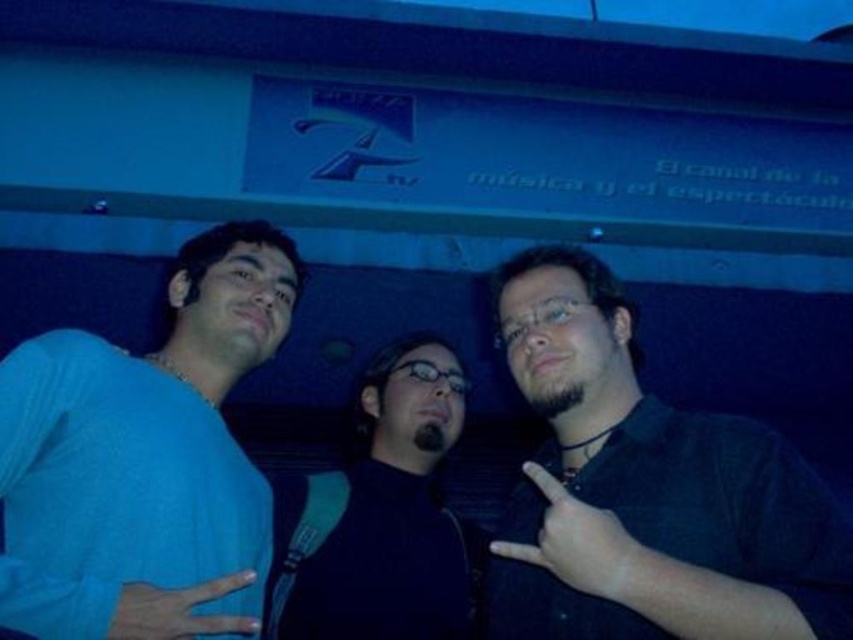
Where is `black matte hand at center`? The image size is (853, 640). black matte hand at center is located at coordinates (584, 547).

Who is taller, blue matte shirt at left or matte blue hand at center?

With more height is blue matte shirt at left.

Who is more distant from viewer, [38,371] or [204,588]?

Point [38,371]

Find the location of a particular element. The image size is (853, 640). blue matte shirt at left is located at coordinates (144, 458).

Is point (15, 429) positioned before point (631, 586)?

No, (15, 429) is further to viewer.

Does blue matte shirt at left appear on the left side of black matte hand at center?

Yes, blue matte shirt at left is to the left of black matte hand at center.

Describe the element at coordinates (144, 458) in the screenshot. I see `blue matte shirt at left` at that location.

The width and height of the screenshot is (853, 640). Find the location of `blue matte shirt at left`. blue matte shirt at left is located at coordinates (144, 458).